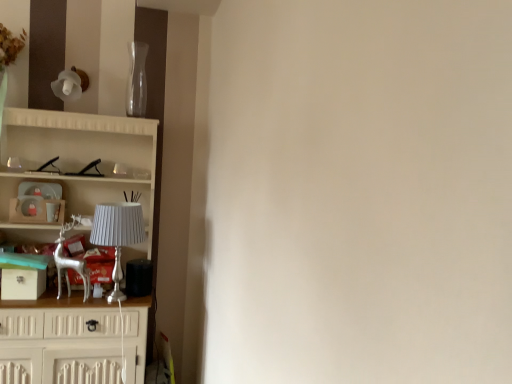
Question: Considering the positions of silver metallic deer at left and transparent glass vase at upper center in the image, is silver metallic deer at left wider or thinner than transparent glass vase at upper center?

Choices:
 (A) wide
 (B) thin

Answer: (A)

Question: Is point (61, 243) positioned closer to the camera than point (143, 52)?

Choices:
 (A) closer
 (B) farther

Answer: (A)

Question: Based on their relative distances, which object is nearer to the transparent glass vase at upper center?

Choices:
 (A) silver metallic lamp at left
 (B) silver metallic deer at left
 (C) white wooden cupboard at left

Answer: (C)

Question: Which is nearer to the silver metallic lamp at left?

Choices:
 (A) white wooden cupboard at left
 (B) silver metallic deer at left
 (C) transparent glass vase at upper center

Answer: (B)